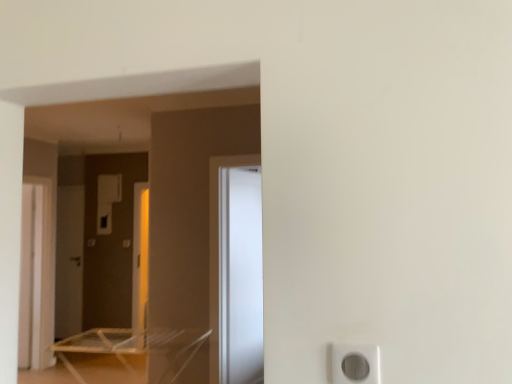
Question: Can we say clear plastic table at lower left lies outside white glossy screen door at center, which is the 1th screen door in right-to-left order?

Choices:
 (A) yes
 (B) no

Answer: (A)

Question: From a real-world perspective, is clear plastic table at lower left over white glossy screen door at center, marked as the 3th screen door in a left-to-right arrangement?

Choices:
 (A) yes
 (B) no

Answer: (B)

Question: From the image's perspective, is clear plastic table at lower left beneath white glossy screen door at center, placed as the first screen door when sorted from front to back?

Choices:
 (A) yes
 (B) no

Answer: (A)

Question: Considering the relative positions of clear plastic table at lower left and white glossy screen door at center, which is the 1th screen door in right-to-left order, in the image provided, is clear plastic table at lower left to the right of white glossy screen door at center, which is the 1th screen door in right-to-left order, from the viewer's perspective?

Choices:
 (A) no
 (B) yes

Answer: (A)

Question: Is clear plastic table at lower left positioned with its back to white glossy screen door at center, which is the 3th screen door from back to front?

Choices:
 (A) no
 (B) yes

Answer: (A)

Question: In terms of size, does clear plastic table at lower left appear bigger or smaller than white glossy screen door at center, marked as the 3th screen door in a left-to-right arrangement?

Choices:
 (A) small
 (B) big

Answer: (B)

Question: Relative to white glossy screen door at center, which is the 1th screen door in right-to-left order, is clear plastic table at lower left in front or behind?

Choices:
 (A) behind
 (B) front

Answer: (B)

Question: Considering the positions of clear plastic table at lower left and white glossy screen door at center, marked as the 3th screen door in a left-to-right arrangement, in the image, is clear plastic table at lower left wider or thinner than white glossy screen door at center, marked as the 3th screen door in a left-to-right arrangement,?

Choices:
 (A) thin
 (B) wide

Answer: (B)

Question: Considering the positions of point (117, 355) and point (229, 329), is point (117, 355) closer or farther from the camera than point (229, 329)?

Choices:
 (A) closer
 (B) farther

Answer: (B)

Question: From the image's perspective, is white glossy screen door at center, placed as the first screen door when sorted from front to back, positioned above or below clear plastic table at lower left?

Choices:
 (A) above
 (B) below

Answer: (A)

Question: In terms of width, does white glossy screen door at center, marked as the 3th screen door in a left-to-right arrangement, look wider or thinner when compared to clear plastic table at lower left?

Choices:
 (A) thin
 (B) wide

Answer: (A)

Question: Would you say white glossy screen door at center, placed as the first screen door when sorted from front to back, is to the left or to the right of clear plastic table at lower left in the picture?

Choices:
 (A) right
 (B) left

Answer: (A)

Question: Is white glossy screen door at center, marked as the 3th screen door in a left-to-right arrangement, inside the boundaries of clear plastic table at lower left, or outside?

Choices:
 (A) inside
 (B) outside

Answer: (B)

Question: Is point (197, 342) positioned closer to the camera than point (56, 226)?

Choices:
 (A) closer
 (B) farther

Answer: (A)

Question: Do you think clear plastic table at lower left is within matte brown screen door at left, acting as the first screen door starting from the left, or outside of it?

Choices:
 (A) outside
 (B) inside

Answer: (A)